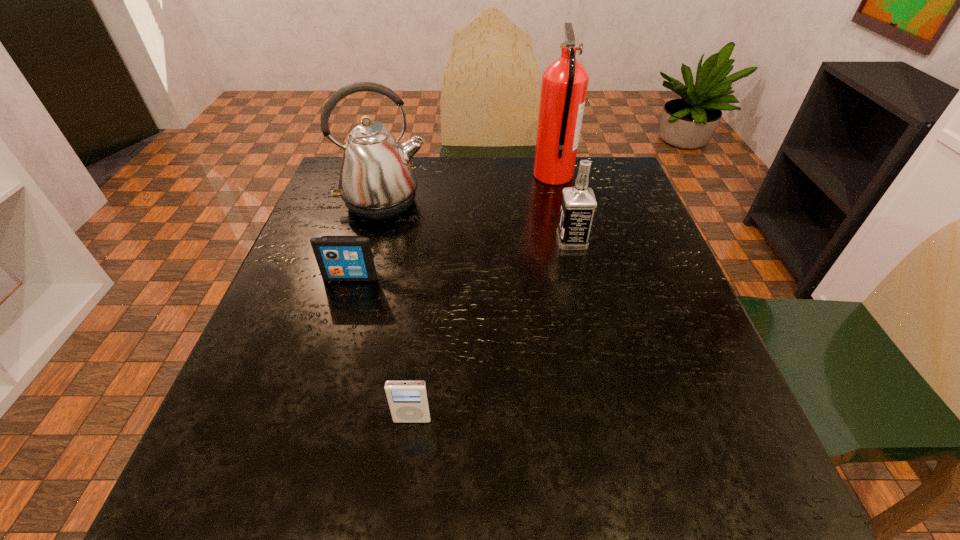
Locate which object is the closest to the kettle. Please provide its 2D coordinates. Your answer should be formatted as a tuple, i.e. [(x, y)], where the tuple contains the x and y coordinates of a point satisfying the conditions above.

[(340, 258)]

I want to click on vacant space that satisfies the following two spatial constraints: 1. at the nozzle of the fire extinguisher; 2. on the front-facing side of the nearer iPod, so click(608, 420).

Find the location of a particular element. This screenshot has height=540, width=960. vacant region that satisfies the following two spatial constraints: 1. on the front label of the vodka; 2. on the front screen of the farther iPod is located at coordinates (580, 278).

The image size is (960, 540). Identify the location of free point that satisfies the following two spatial constraints: 1. at the nozzle of the fire extinguisher; 2. on the front-facing side of the nearest object. coord(608,420).